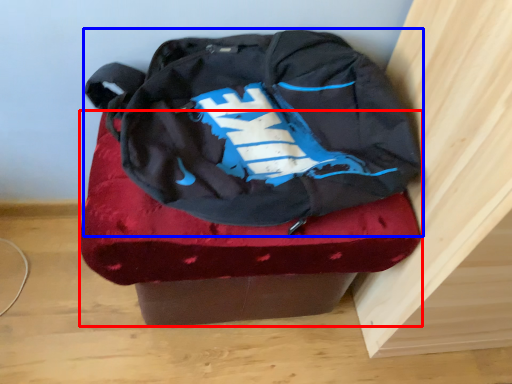
Question: Which of the following is the closest to the observer, furniture (highlighted by a red box) or backpack (highlighted by a blue box)?

Choices:
 (A) furniture
 (B) backpack

Answer: (B)